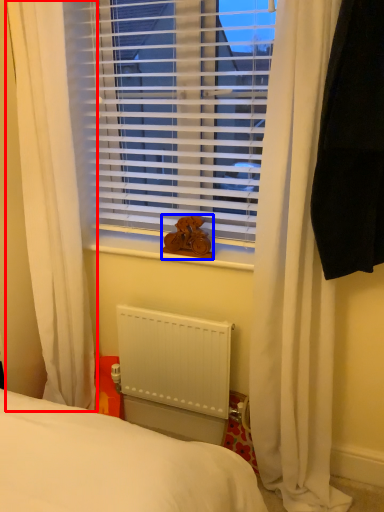
Question: Which of the following is the closest to the observer, curtain (highlighted by a red box) or animal (highlighted by a blue box)?

Choices:
 (A) curtain
 (B) animal

Answer: (A)